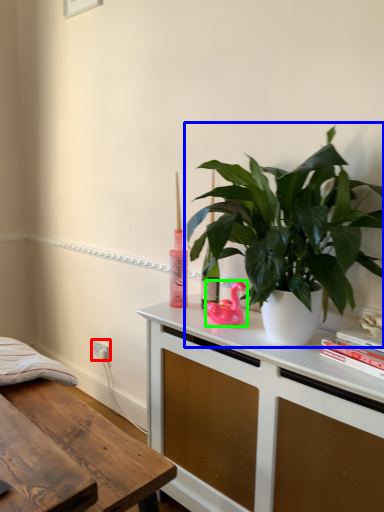
Question: Which object is positioned closest to electric outlet (highlighted by a red box)? Select from houseplant (highlighted by a blue box) and appliance (highlighted by a green box).

Choices:
 (A) houseplant
 (B) appliance

Answer: (B)